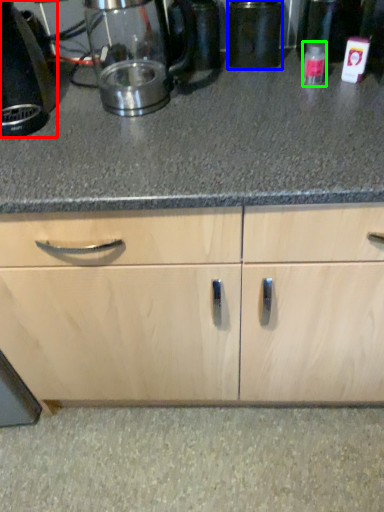
Question: Which is nearer to the home appliance (highlighted by a red box)? appliance (highlighted by a blue box) or bottle (highlighted by a green box).

Choices:
 (A) appliance
 (B) bottle

Answer: (A)